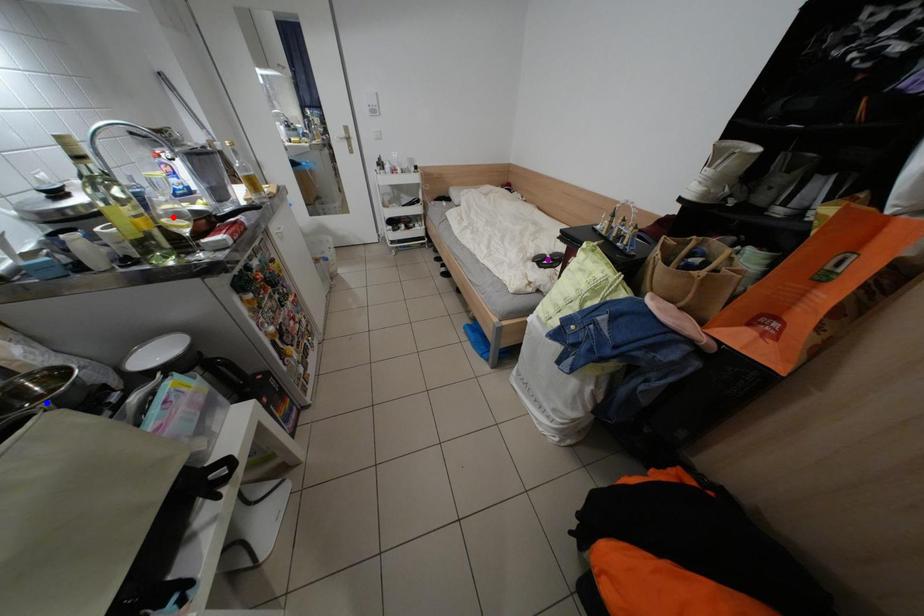
Order these from nearest to farthest:
1. red point
2. blue point
3. purple point

1. blue point
2. red point
3. purple point